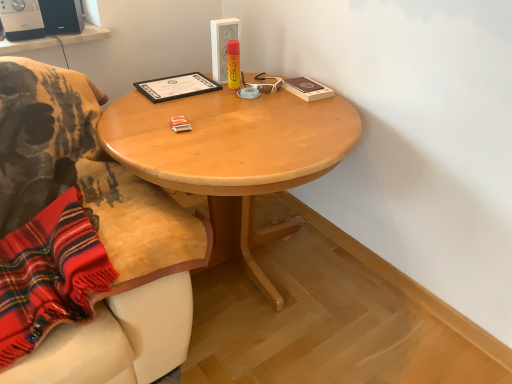
Question: Is the surface of black matte certificate at upper center in direct contact with matte black speaker at upper left, the 1th loudspeaker from the right?

Choices:
 (A) no
 (B) yes

Answer: (A)

Question: Is black matte certificate at upper center to the right of matte black speaker at upper left, the 2th loudspeaker viewed from the left, from the viewer's perspective?

Choices:
 (A) no
 (B) yes

Answer: (B)

Question: Would you consider black matte certificate at upper center to be distant from matte black speaker at upper left, the 2th loudspeaker viewed from the left?

Choices:
 (A) yes
 (B) no

Answer: (B)

Question: Is black matte certificate at upper center at the left side of matte black speaker at upper left, the 2th loudspeaker viewed from the left?

Choices:
 (A) yes
 (B) no

Answer: (B)

Question: From a real-world perspective, is black matte certificate at upper center positioned under matte black speaker at upper left, the 2th loudspeaker viewed from the left, based on gravity?

Choices:
 (A) no
 (B) yes

Answer: (B)

Question: Is black matte certificate at upper center positioned behind matte black speaker at upper left, the 2th loudspeaker viewed from the left?

Choices:
 (A) no
 (B) yes

Answer: (A)

Question: Considering the relative positions of black plastic speaker at upper left, the 1th loudspeaker from the left, and light wood table at center in the image provided, is black plastic speaker at upper left, the 1th loudspeaker from the left, to the right of light wood table at center from the viewer's perspective?

Choices:
 (A) yes
 (B) no

Answer: (B)

Question: Does black plastic speaker at upper left, the 1th loudspeaker from the left, appear on the left side of light wood table at center?

Choices:
 (A) no
 (B) yes

Answer: (B)

Question: Is black plastic speaker at upper left, which is counted as the second loudspeaker, starting from the right, looking in the opposite direction of light wood table at center?

Choices:
 (A) yes
 (B) no

Answer: (B)

Question: Could light wood table at center be considered to be inside black plastic speaker at upper left, which is counted as the second loudspeaker, starting from the right?

Choices:
 (A) yes
 (B) no

Answer: (B)

Question: Is black plastic speaker at upper left, which is counted as the second loudspeaker, starting from the right, in front of light wood table at center?

Choices:
 (A) no
 (B) yes

Answer: (A)

Question: Is black plastic speaker at upper left, the 1th loudspeaker from the left, bigger than light wood table at center?

Choices:
 (A) yes
 (B) no

Answer: (B)

Question: Can you confirm if black matte certificate at upper center is bigger than light wood table at center?

Choices:
 (A) yes
 (B) no

Answer: (B)